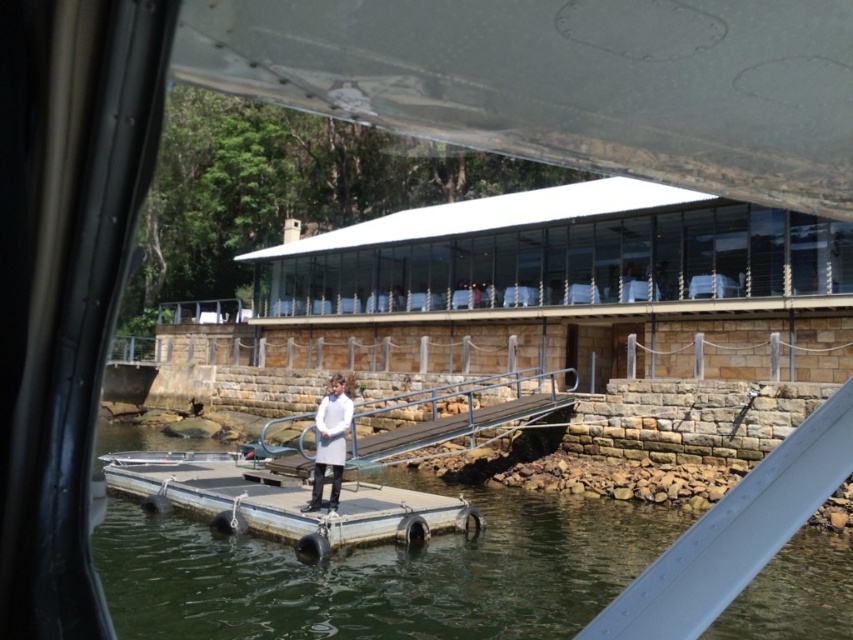
You are on a boat and want to assess the water level relative to the dock rail. Based on the scene, which object, the clear water at center or the metallic gray rail at center, is higher in elevation?

The clear water at center has a greater height compared to the metallic gray rail at center, so the water is higher in elevation than the rail.

You are navigating a small boat and need to avoid shallow areas. The clear water at center indicates deeper water. Where should you steer your boat to ensure safe passage?

You should steer your boat towards the clear water at center, as it is located at point (381, 576), which indicates deeper water and safe passage.